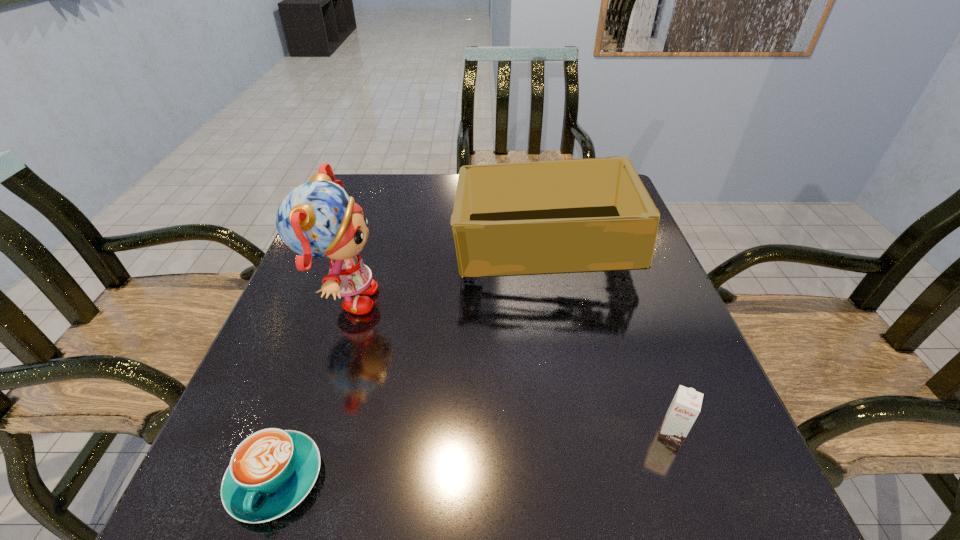
You are a GUI agent. You are given a task and a screenshot of the screen. Output one action in this format:
    pyautogui.click(x=<x>, y=<y>)
    Task: Click on the cappuccino present at the left edge
    This screenshot has height=540, width=960.
    Given the screenshot: What is the action you would take?
    pyautogui.click(x=271, y=471)

You are a GUI agent. You are given a task and a screenshot of the screen. Output one action in this format:
    pyautogui.click(x=<x>, y=<y>)
    Task: Click on the box at the right edge
    This screenshot has height=540, width=960.
    Given the screenshot: What is the action you would take?
    pyautogui.click(x=587, y=215)

At what (x,y) coordinates should I click in order to perform the action: click on chocolate milk at the right edge. Please return your answer as a coordinate pair (x, y). Looking at the image, I should click on (685, 407).

You are a GUI agent. You are given a task and a screenshot of the screen. Output one action in this format:
    pyautogui.click(x=<x>, y=<y>)
    Task: Click on the object present at the near left corner
    
    Given the screenshot: What is the action you would take?
    pyautogui.click(x=271, y=471)

Where is `object that is at the far right corner`? This screenshot has height=540, width=960. object that is at the far right corner is located at coordinates (587, 215).

This screenshot has height=540, width=960. I want to click on vacant space at the far edge of the desktop, so click(420, 209).

The width and height of the screenshot is (960, 540). In the image, there is a desktop. In order to click on free space at the near edge in this screenshot , I will do `click(451, 534)`.

This screenshot has width=960, height=540. I want to click on free space at the left edge, so click(x=309, y=293).

This screenshot has height=540, width=960. In order to click on vacant space at the right edge of the desktop in this screenshot , I will do `click(659, 334)`.

The height and width of the screenshot is (540, 960). Find the location of `vacant point at the far left corner`. vacant point at the far left corner is located at coordinates (390, 174).